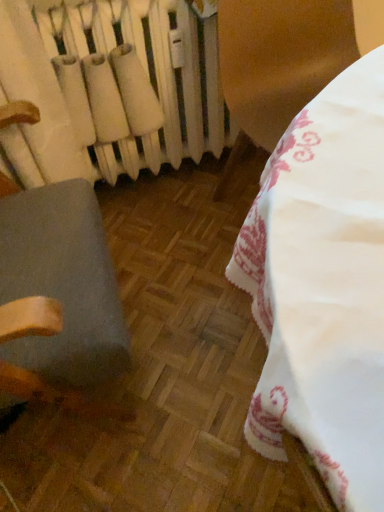
You are a GUI agent. You are given a task and a screenshot of the screen. Output one action in this format:
    pyautogui.click(x=<x>, y=<y>)
    Task: Click on the free area below white matte radiator at upper left (from a real-world perspective)
    The width and height of the screenshot is (384, 512).
    Given the screenshot: What is the action you would take?
    [x=146, y=177]